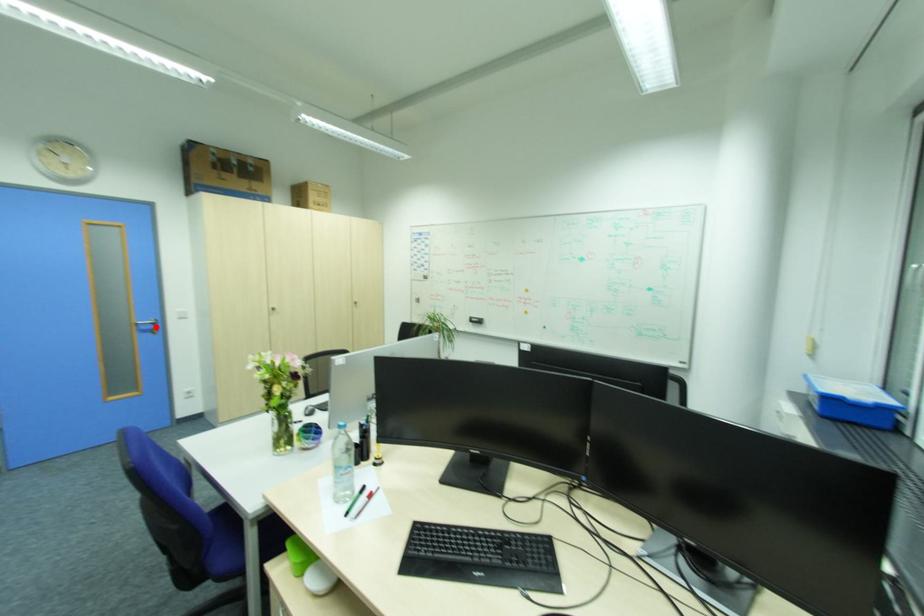
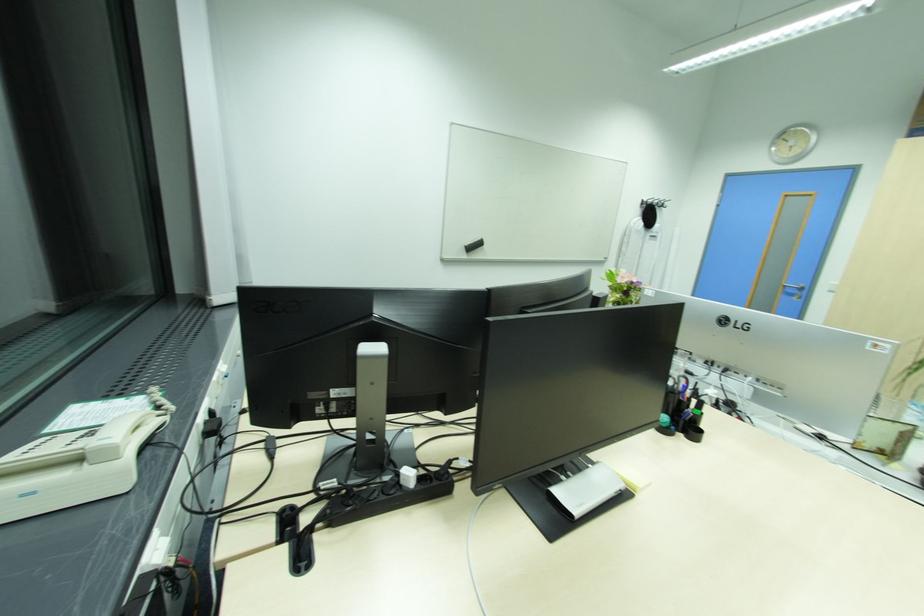
The point at the highlighted location is marked in the first image. Where is the corresponding point in the second image?

(801, 291)